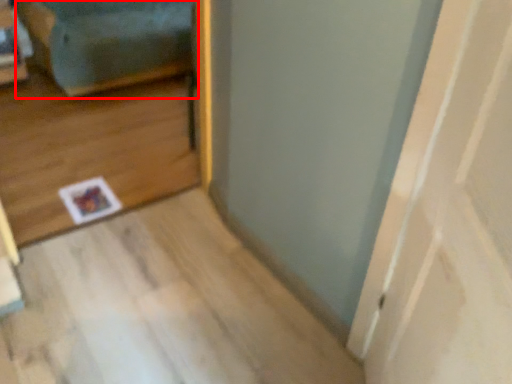
Question: From the image, what is the correct spatial relationship of couch (annotated by the red box) in relation to door?

Choices:
 (A) right
 (B) left

Answer: (B)